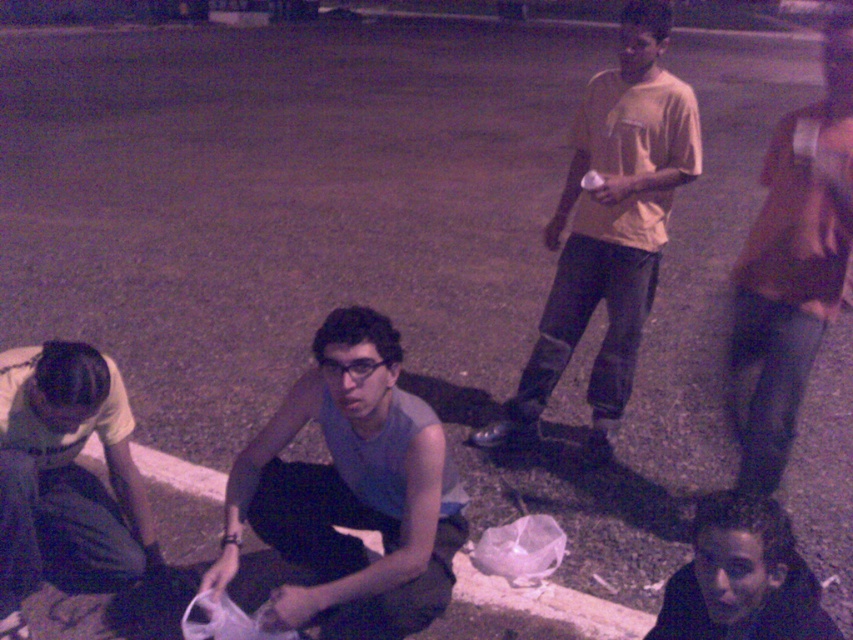
Question: Does light yellow t-shirt at upper right appear under light gray fabric pants at lower left?

Choices:
 (A) yes
 (B) no

Answer: (B)

Question: Considering the real-world distances, which object is farthest from the dark gray fabric at lower right?

Choices:
 (A) matte gray tank top at center
 (B) brown leather jacket at right
 (C) light gray fabric pants at lower left
 (D) white plastic bag at lower center

Answer: (D)

Question: Is matte gray tank top at center wider than white plastic bag at lower center?

Choices:
 (A) yes
 (B) no

Answer: (A)

Question: Is brown leather jacket at right closer to camera compared to light gray fabric pants at lower left?

Choices:
 (A) yes
 (B) no

Answer: (B)

Question: Based on their relative distances, which object is nearer to the brown leather jacket at right?

Choices:
 (A) dark gray fabric at lower right
 (B) matte gray tank top at center

Answer: (A)

Question: Which point is closer to the camera?

Choices:
 (A) (636, 344)
 (B) (436, 572)

Answer: (B)